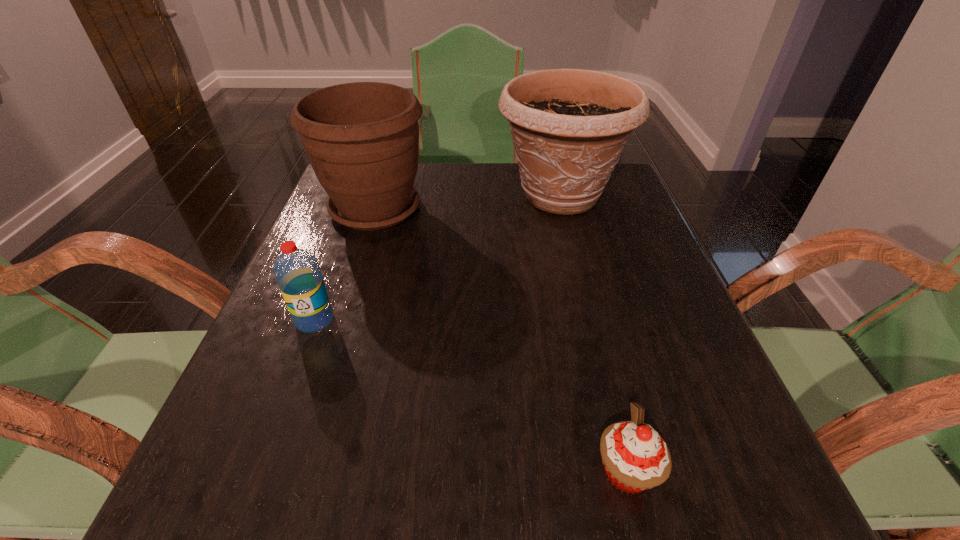
Where is `vacant space at the left edge`? vacant space at the left edge is located at coordinates (224, 415).

Identify the location of vacant point at the right edge. The height and width of the screenshot is (540, 960). (607, 260).

Image resolution: width=960 pixels, height=540 pixels. I want to click on vacant space at the far right corner of the desktop, so click(624, 178).

Locate an element on the screen. This screenshot has height=540, width=960. vacant space at the near right corner of the desktop is located at coordinates (663, 485).

Find the location of a particular element. This screenshot has width=960, height=540. free spot between the shortest object and the water bottle is located at coordinates (470, 395).

At what (x,y) coordinates should I click in order to perform the action: click on free space that is in between the second nearest object and the right flowerpot. Please return your answer as a coordinate pair (x, y). This screenshot has height=540, width=960. Looking at the image, I should click on (438, 258).

Where is `free space between the cupcake and the third tallest object`? The height and width of the screenshot is (540, 960). free space between the cupcake and the third tallest object is located at coordinates (470, 395).

Locate an element on the screen. The image size is (960, 540). free point between the cupcake and the right flowerpot is located at coordinates (593, 333).

Locate an element on the screen. vacant area between the shortest object and the left flowerpot is located at coordinates (501, 340).

Identify the location of empty location between the second nearest object and the left flowerpot. The width and height of the screenshot is (960, 540). (345, 265).